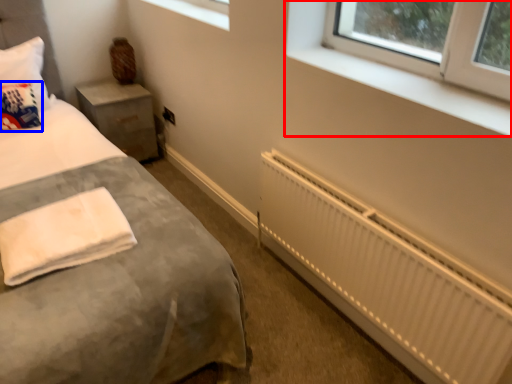
Question: Among these objects, which one is nearest to the camera, window (highlighted by a red box) or throw pillow (highlighted by a blue box)?

Choices:
 (A) window
 (B) throw pillow

Answer: (A)